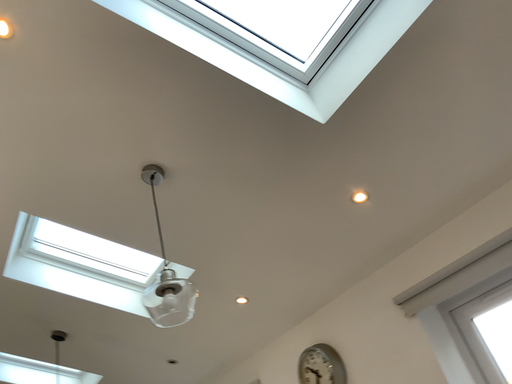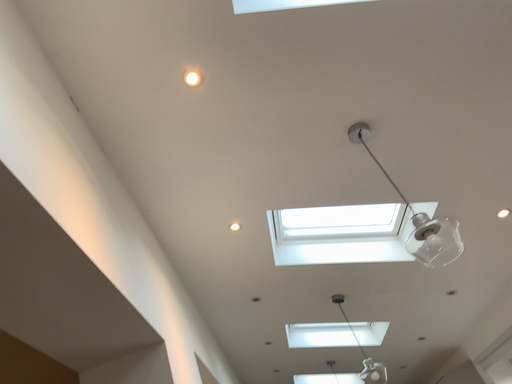
Question: How did the camera likely rotate when shooting the video?

Choices:
 (A) rotated upward
 (B) rotated downward

Answer: (B)